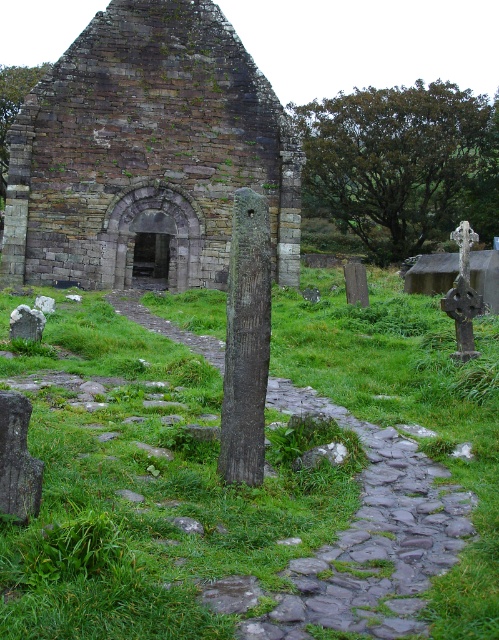
Question: Can you confirm if rustic stone church at center is wider than rough stone path at center?

Choices:
 (A) no
 (B) yes

Answer: (B)

Question: Among these points, which one is nearest to the camera?

Choices:
 (A) [367, 506]
 (B) [131, 166]

Answer: (A)

Question: Which of the following is the closest to the observer?

Choices:
 (A) (190, 152)
 (B) (355, 588)

Answer: (B)

Question: Is rustic stone church at center bigger than rough stone path at center?

Choices:
 (A) yes
 (B) no

Answer: (A)

Question: Is rustic stone church at center wider than rough stone path at center?

Choices:
 (A) yes
 (B) no

Answer: (A)

Question: Which object appears closest to the camera in this image?

Choices:
 (A) rustic stone church at center
 (B) rough stone path at center

Answer: (B)